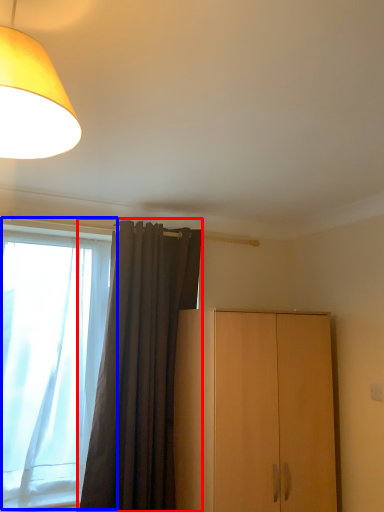
Question: Among these objects, which one is nearest to the camera, curtain (highlighted by a red box) or window (highlighted by a blue box)?

Choices:
 (A) curtain
 (B) window

Answer: (A)